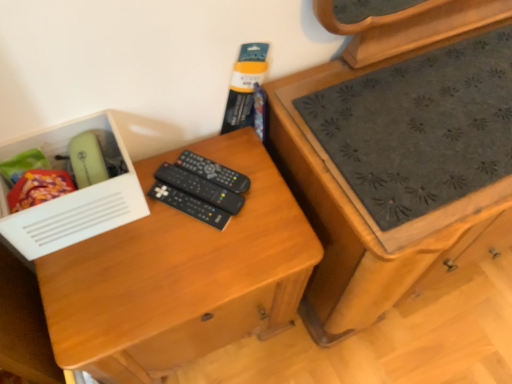
The height and width of the screenshot is (384, 512). I want to click on free space that is in between white plastic box at left and black plastic remote controls at center, the second remote control positioned from the bottom, so click(x=139, y=225).